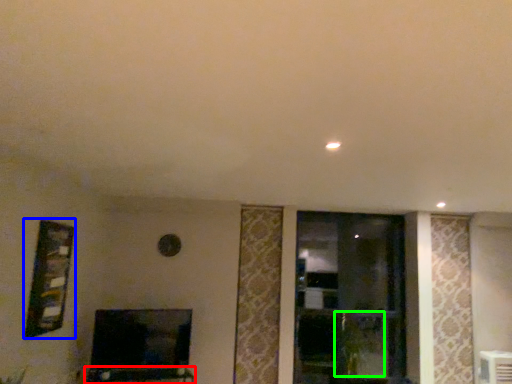
Question: Estimate the real-world distances between objects in this image. Which object is closer to furniture (highlighted by a red box), picture frame (highlighted by a blue box) or plant (highlighted by a green box)?

Choices:
 (A) picture frame
 (B) plant

Answer: (A)